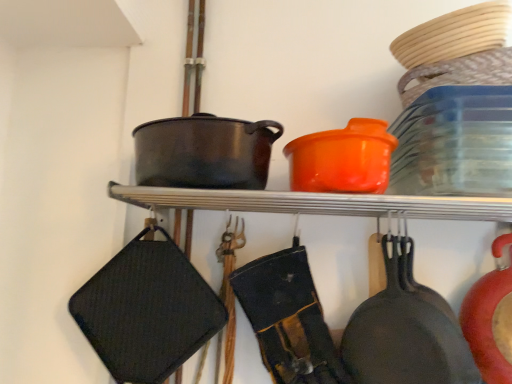
Describe the element at coordinates (204, 152) in the screenshot. I see `matte black wok at center` at that location.

You are a GUI agent. You are given a task and a screenshot of the screen. Output one action in this format:
    pyautogui.click(x=<x>, y=<y>)
    Task: Click on the matte black frying pan at lower right
    The height and width of the screenshot is (384, 512).
    Given the screenshot: What is the action you would take?
    pyautogui.click(x=406, y=330)

From the image's perspective, is orange plastic pot at upper center below matte black wok at center?

Yes, from the image's perspective, orange plastic pot at upper center is beneath matte black wok at center.

Is point (286, 157) farther from viewer compared to point (194, 117)?

Yes.

From a real-world perspective, which object stands above the other?

From a 3D spatial view, matte black wok at center is above.

Considering the relative sizes of orange plastic pot at upper center and matte black wok at center in the image provided, is orange plastic pot at upper center bigger than matte black wok at center?

Incorrect, orange plastic pot at upper center is not larger than matte black wok at center.

Find the location of a particular element. The width and height of the screenshot is (512, 384). wok lying above the orange matte pot at upper center (from the image's perspective) is located at coordinates (204, 152).

From the image's perspective, which is above, orange matte pot at upper center or matte black wok at center?

→ From the image's view, matte black wok at center is above.

Can you tell me how much orange matte pot at upper center and matte black wok at center differ in facing direction?

The facing directions of orange matte pot at upper center and matte black wok at center are 0.000675 degrees apart.

Which of these two, orange matte pot at upper center or matte black wok at center, is smaller?

orange matte pot at upper center is smaller.

Would you say orange plastic pot at upper center is part of matte black wok at center's contents?

Actually, orange plastic pot at upper center is outside matte black wok at center.

Is matte black wok at center not near orange plastic pot at upper center?

No, matte black wok at center is not far from orange plastic pot at upper center.

In terms of size, does matte black wok at center appear bigger or smaller than orange plastic pot at upper center?

matte black wok at center is bigger than orange plastic pot at upper center.

Is matte black wok at center oriented towards matte black frying pan at lower right?

No, matte black wok at center does not turn towards matte black frying pan at lower right.

Can you confirm if matte black wok at center is taller than matte black frying pan at lower right?

Incorrect, the height of matte black wok at center is not larger of that of matte black frying pan at lower right.

In the scene shown: Measure the distance from matte black wok at center to matte black frying pan at lower right.

The distance of matte black wok at center from matte black frying pan at lower right is 14.87 inches.

Is matte black wok at center at the left side of matte black frying pan at lower right?

Yes, matte black wok at center is to the left of matte black frying pan at lower right.

Which point is more forward, (364,350) or (389,142)?

Point (389,142)

Does matte black frying pan at lower right touch orange plastic pot at upper center?

No, matte black frying pan at lower right is not in contact with orange plastic pot at upper center.

In the scene shown: How different are the orientations of matte black frying pan at lower right and orange plastic pot at upper center in degrees?

0.000884 degrees separate the facing orientations of matte black frying pan at lower right and orange plastic pot at upper center.

From a real-world perspective, which object rests below the other?

matte black frying pan at lower right is physically lower.

Does matte black wok at center appear on the left side of orange matte pot at upper center?

Yes, matte black wok at center is to the left of orange matte pot at upper center.

Is point (179, 163) more distant than point (152, 192)?

No, it is in front of (152, 192).

From the image's perspective, would you say matte black wok at center is shown under orange matte pot at upper center?

Actually, matte black wok at center appears above orange matte pot at upper center in the image.

Locate an element on the screen. The width and height of the screenshot is (512, 384). shelf below the matte black wok at center (from the image's perspective) is located at coordinates (317, 203).

Considering the positions of objects orange matte pot at upper center and orange plastic pot at upper center in the image provided, who is more to the right, orange matte pot at upper center or orange plastic pot at upper center?

Positioned to the right is orange plastic pot at upper center.

Is orange plastic pot at upper center located within orange matte pot at upper center?

No, orange plastic pot at upper center is not a part of orange matte pot at upper center.

Is orange matte pot at upper center directly adjacent to orange plastic pot at upper center?

orange matte pot at upper center and orange plastic pot at upper center are not in contact.

Can you confirm if orange matte pot at upper center is thinner than orange plastic pot at upper center?

Indeed, orange matte pot at upper center has a lesser width compared to orange plastic pot at upper center.

This screenshot has width=512, height=384. Find the location of `tableware below the matte black wok at center (from the image's perspective)`. tableware below the matte black wok at center (from the image's perspective) is located at coordinates (342, 159).

Find the location of a particular element. shelf in front of the matte black wok at center is located at coordinates (317, 203).

Which object lies further to the anchor point orange plastic pot at upper center, matte black wok at center or matte black frying pan at lower right?

Among the two, matte black frying pan at lower right is located further to orange plastic pot at upper center.

When comparing their distances from orange matte pot at upper center, does matte black wok at center or matte black frying pan at lower right seem closer?

Among the two, matte black wok at center is located nearer to orange matte pot at upper center.

Which object lies further to the anchor point matte black wok at center, matte black frying pan at lower right or orange plastic pot at upper center?

Based on the image, matte black frying pan at lower right appears to be further to matte black wok at center.

Looking at the image, which one is located closer to orange plastic pot at upper center, matte black frying pan at lower right or matte black wok at center?

The object closer to orange plastic pot at upper center is matte black wok at center.

Based on their spatial positions, is orange matte pot at upper center or matte black frying pan at lower right closer to orange plastic pot at upper center?

orange matte pot at upper center lies closer to orange plastic pot at upper center than the other object.

Estimate the real-world distances between objects in this image. Which object is further from orange plastic pot at upper center, matte black frying pan at lower right or orange matte pot at upper center?

matte black frying pan at lower right is positioned further to the anchor orange plastic pot at upper center.

Considering their positions, is matte black wok at center positioned further to matte black frying pan at lower right than orange plastic pot at upper center?

matte black wok at center.

When comparing their distances from orange matte pot at upper center, does matte black wok at center or orange plastic pot at upper center seem further?

matte black wok at center lies further to orange matte pot at upper center than the other object.

Image resolution: width=512 pixels, height=384 pixels. What are the coordinates of `shelf situated between matte black wok at center and orange plastic pot at upper center from left to right` in the screenshot? It's located at 317,203.

At what (x,y) coordinates should I click in order to perform the action: click on shelf between orange plastic pot at upper center and matte black frying pan at lower right in the up-down direction. Please return your answer as a coordinate pair (x, y). Looking at the image, I should click on (317, 203).

Where is `tableware between matte black wok at center and matte black frying pan at lower right`? tableware between matte black wok at center and matte black frying pan at lower right is located at coordinates (342, 159).

Image resolution: width=512 pixels, height=384 pixels. Identify the location of shelf situated between matte black wok at center and matte black frying pan at lower right from left to right. (317, 203).